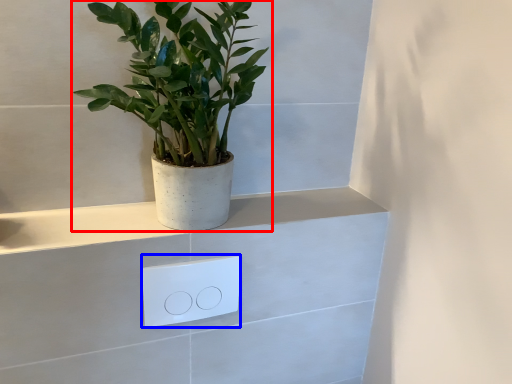
Question: Which point is closer to the camera, houseplant (highlighted by a red box) or light switch (highlighted by a blue box)?

Choices:
 (A) houseplant
 (B) light switch

Answer: (A)